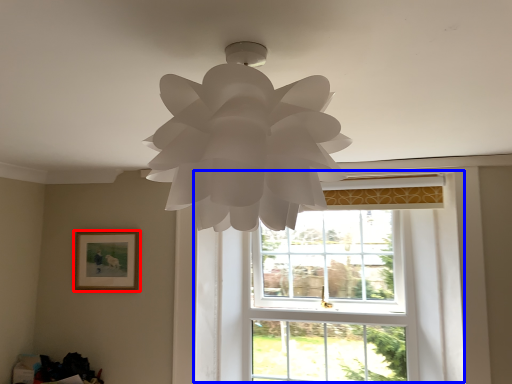
Question: Among these objects, which one is nearest to the camera, picture frame (highlighted by a red box) or window (highlighted by a blue box)?

Choices:
 (A) picture frame
 (B) window

Answer: (B)